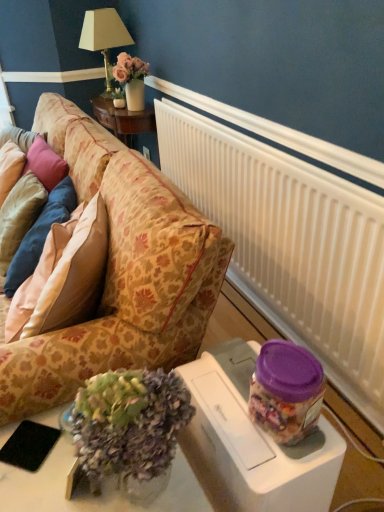
You are a GUI agent. You are given a task and a screenshot of the screen. Output one action in this format:
    pyautogui.click(x=<x>, y=<y>)
    Task: Click on the vacant space to the right of black matte pad at lower left
    This screenshot has width=384, height=512.
    Given the screenshot: What is the action you would take?
    pyautogui.click(x=72, y=466)